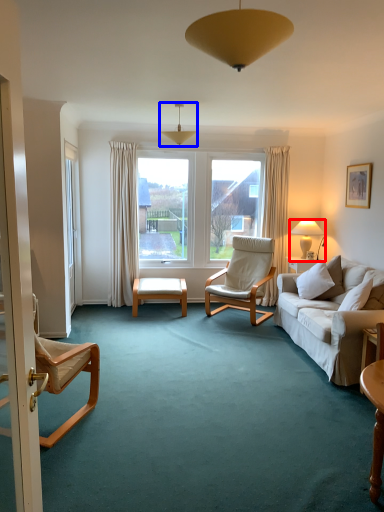
Question: Among these objects, which one is farthest to the camera, lamp (highlighted by a red box) or lamp (highlighted by a blue box)?

Choices:
 (A) lamp
 (B) lamp

Answer: (A)